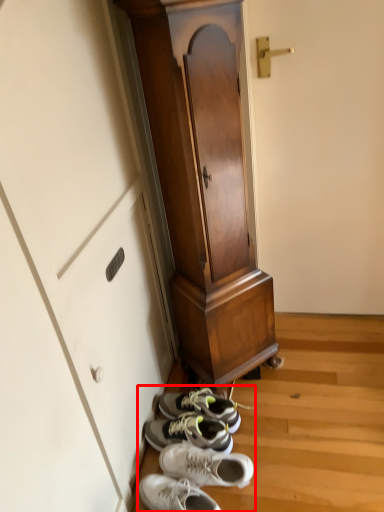
Question: From the image's perspective, considering the relative positions of shoe (annotated by the red box) and furniture in the image provided, where is shoe (annotated by the red box) located with respect to the staircase?

Choices:
 (A) below
 (B) above

Answer: (A)